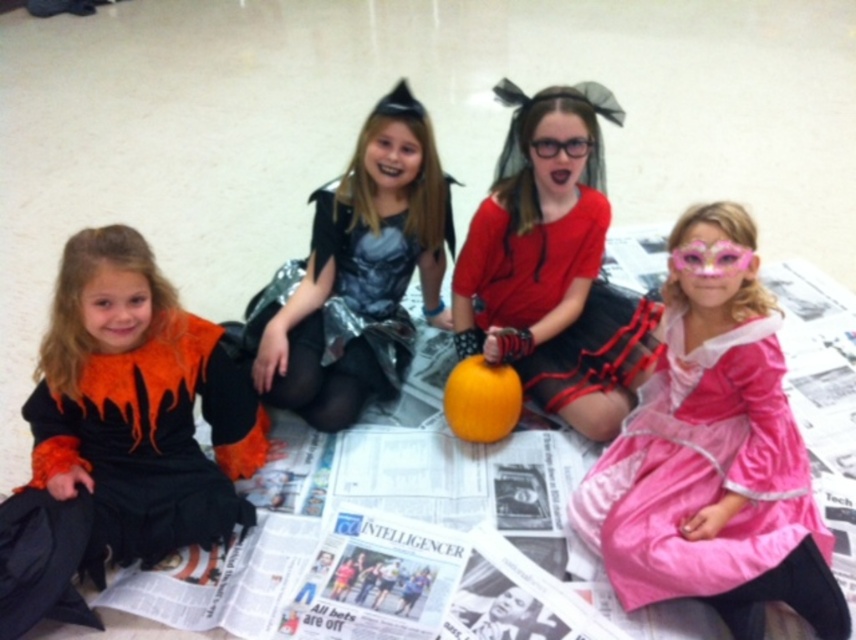
Question: Which of the following is the closest to the observer?

Choices:
 (A) shiny silver dress at center
 (B) pink satin dress at lower right
 (C) matte red dress at center
 (D) orange matte/black fabric dress at left

Answer: (B)

Question: Which point is closer to the camera taking this photo?

Choices:
 (A) (734, 525)
 (B) (495, 250)

Answer: (A)

Question: Estimate the real-world distances between objects in this image. Which object is farther from the pink satin dress at lower right?

Choices:
 (A) shiny silver dress at center
 (B) orange matte/black fabric dress at left
 (C) matte red dress at center

Answer: (B)

Question: Can you confirm if matte red dress at center is smaller than shiny silver dress at center?

Choices:
 (A) yes
 (B) no

Answer: (A)

Question: Can you confirm if pink satin dress at lower right is bigger than matte red dress at center?

Choices:
 (A) yes
 (B) no

Answer: (B)

Question: Is pink satin dress at lower right above shiny silver dress at center?

Choices:
 (A) no
 (B) yes

Answer: (A)